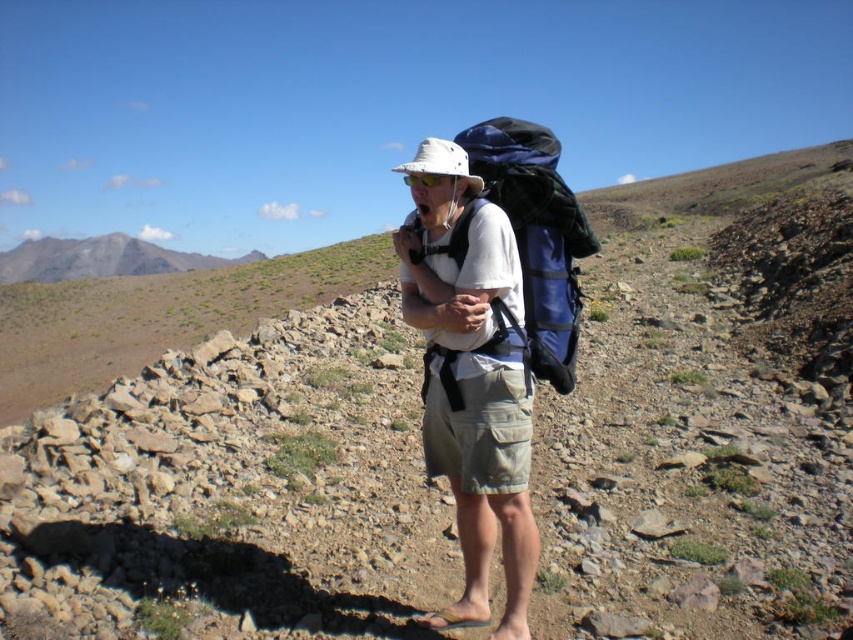
Based on the photo, you are navigating a rocky path as a hiker and need to place two markers at the coordinates point (509, 280) and point (558, 262). Which marker will be closer to your current position?

Point (509, 280) is closer to the viewer than point (558, 262), so the marker at point (509, 280) will be closer to your current position.

You are a hiker trying to navigate the terrain. You see the matte white hat at center and the gray rocky mountain at upper left. Which object is closer to you?

The matte white hat at center is closer to you because it is positioned under the gray rocky mountain at upper left, indicating it is in front of the mountain.

You are a hiker who wants to ensure your gear is visible from a distance. You have a matte white hat at center and a gray rocky mountain at upper left in your view. Which object is shorter in height?

The matte white hat at center has a lesser height compared to the gray rocky mountain at upper left, so the matte white hat at center is shorter in height.